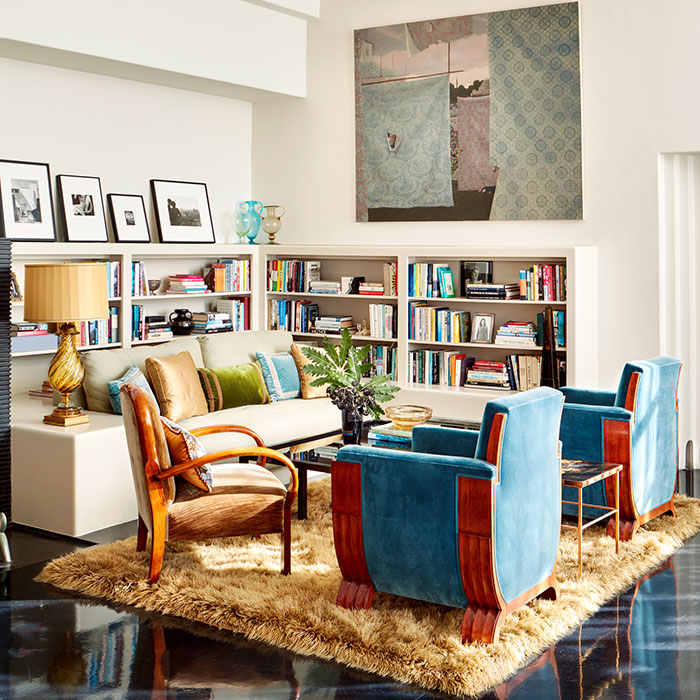
Find the location of a particular element. This screenshot has height=700, width=700. chairs is located at coordinates (222, 497), (411, 505), (600, 423).